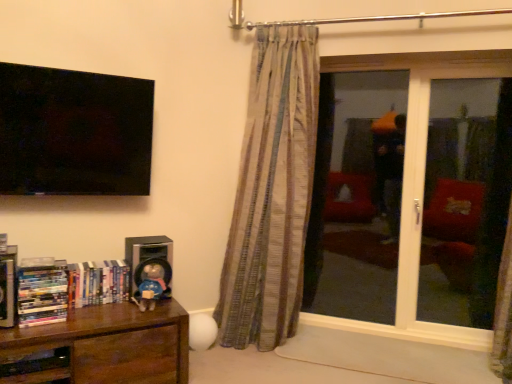
Locate an element on the screen. free space in front of hardcover books at left, the 1th book viewed from the right is located at coordinates (96, 311).